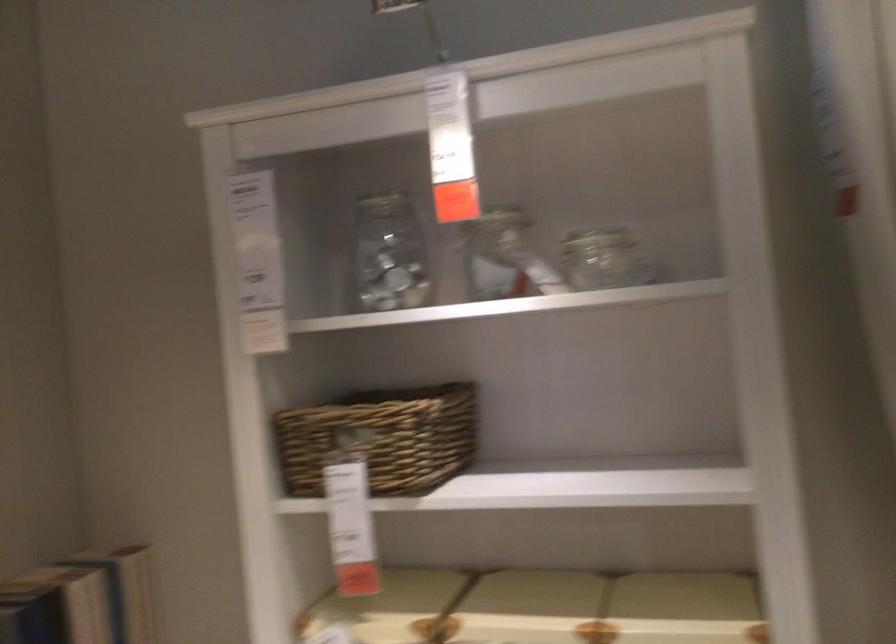
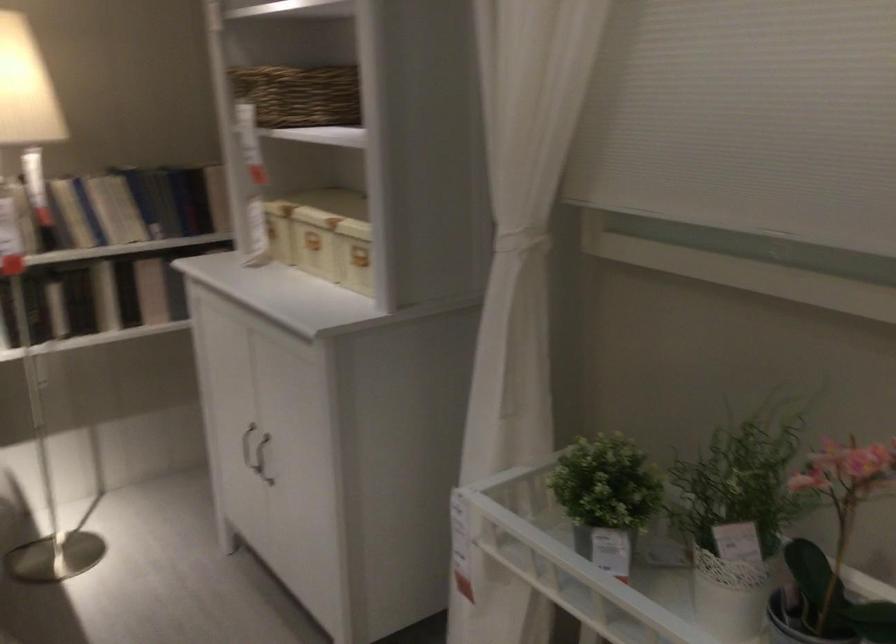
Where in the second image is the point corresponding to pixel 435 431 from the first image?

(298, 93)